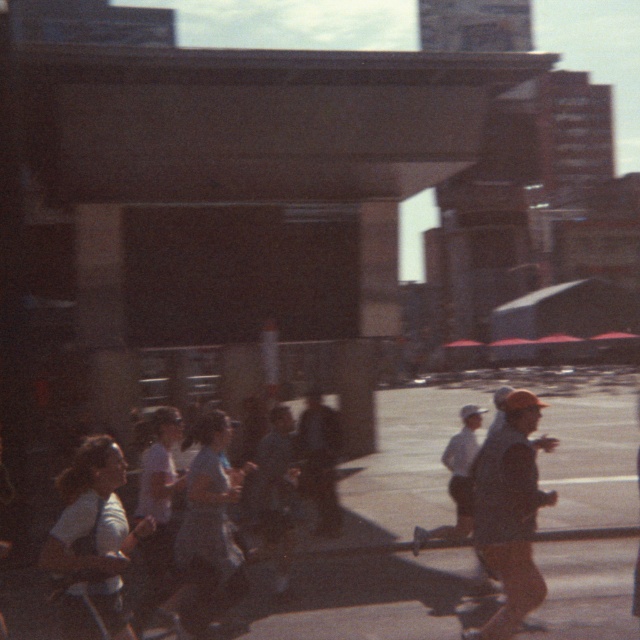
Question: Does smooth asphalt road at center have a larger size compared to orange cap at right?

Choices:
 (A) no
 (B) yes

Answer: (B)

Question: Which point is closer to the camera taking this photo?

Choices:
 (A) (385, 589)
 (B) (522, 611)

Answer: (B)

Question: Is smooth asphalt road at center to the right of orange cap at right from the viewer's perspective?

Choices:
 (A) no
 (B) yes

Answer: (B)

Question: Which point is farther to the camera?

Choices:
 (A) (291, 593)
 (B) (528, 461)

Answer: (A)

Question: Observing the image, what is the correct spatial positioning of smooth asphalt road at center in reference to orange cap at right?

Choices:
 (A) right
 (B) left

Answer: (A)

Question: Which object is closer to the camera taking this photo?

Choices:
 (A) smooth asphalt road at center
 (B) orange cap at right

Answer: (B)